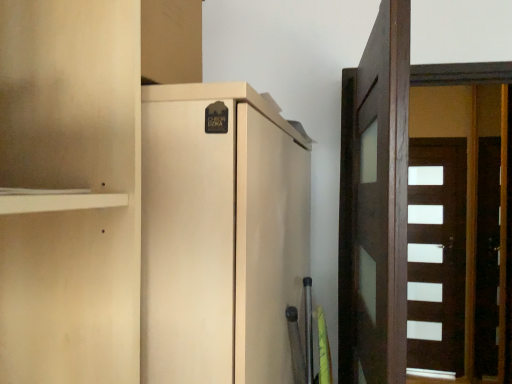
Locate an element on the screen. This screenshot has width=512, height=384. vacant space situated above white glossy door at right, which ranks as the second door in left-to-right order (from a real-world perspective) is located at coordinates (431, 146).